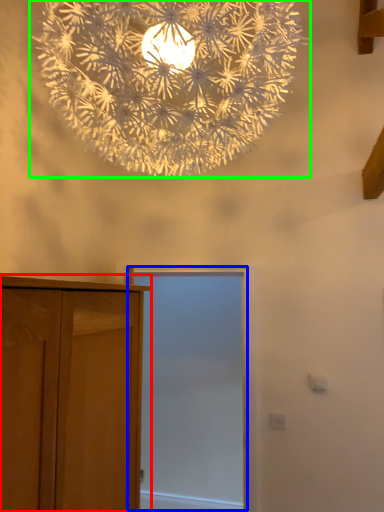
Question: Based on their relative distances, which object is nearer to cupboard (highlighted by a red box)? Choose from screen door (highlighted by a blue box) and lamp (highlighted by a green box).

Choices:
 (A) screen door
 (B) lamp

Answer: (B)